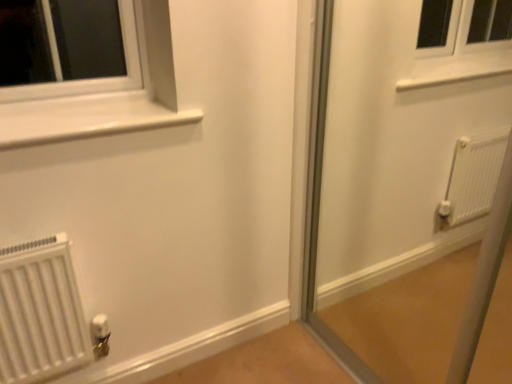
This screenshot has height=384, width=512. What do you see at coordinates (40, 312) in the screenshot?
I see `white matte radiator at lower left` at bounding box center [40, 312].

Measure the distance between white matte radiator at lower left and camera.

3.73 feet.

You are a GUI agent. You are given a task and a screenshot of the screen. Output one action in this format:
    pyautogui.click(x=<x>, y=<y>)
    Task: Click on the white matte radiator at lower left
    The width and height of the screenshot is (512, 384).
    Given the screenshot: What is the action you would take?
    pyautogui.click(x=40, y=312)

Locate an element on the screen. This screenshot has height=384, width=512. white matte radiator at lower left is located at coordinates (40, 312).